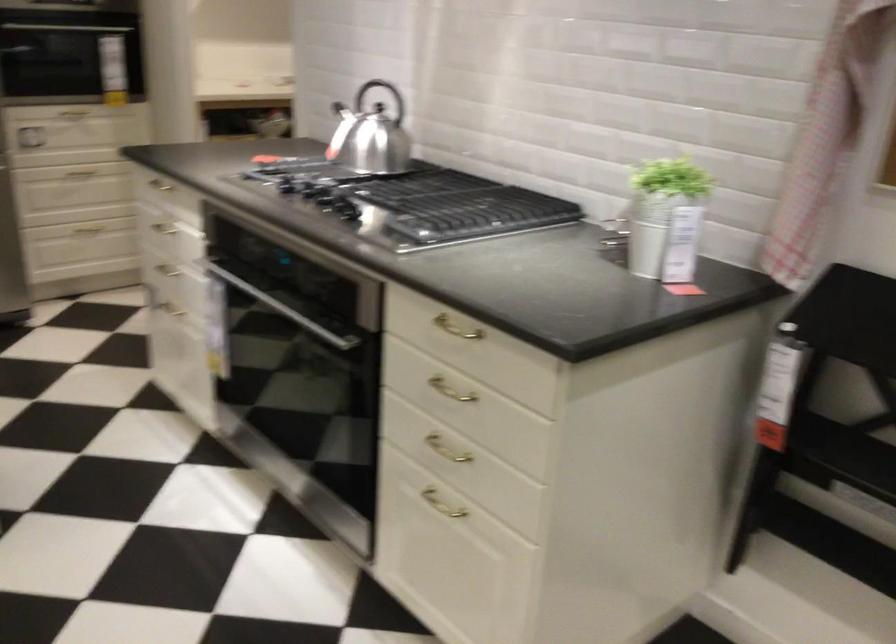
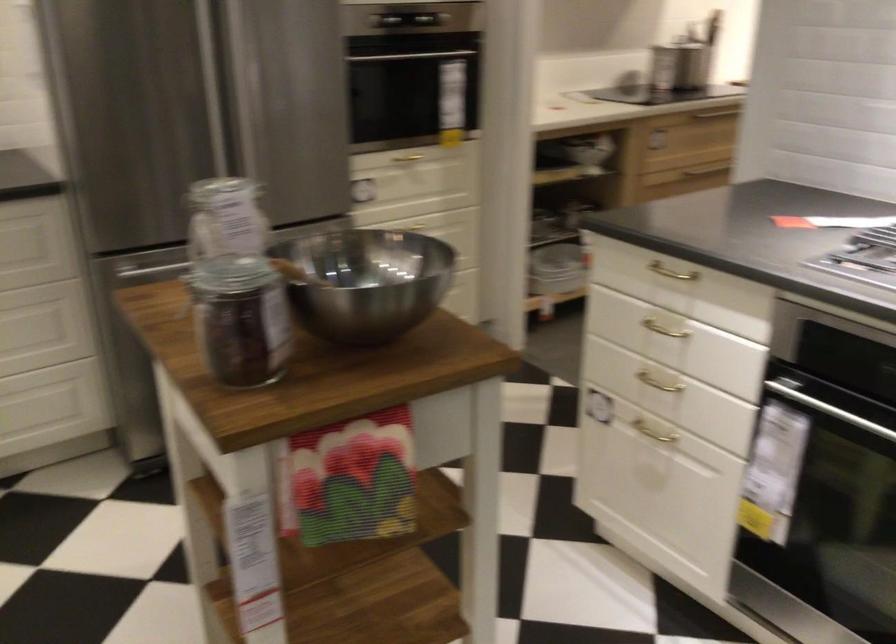
Find the pixel in the second image that matches the point at 176,269 in the first image.

(659, 383)